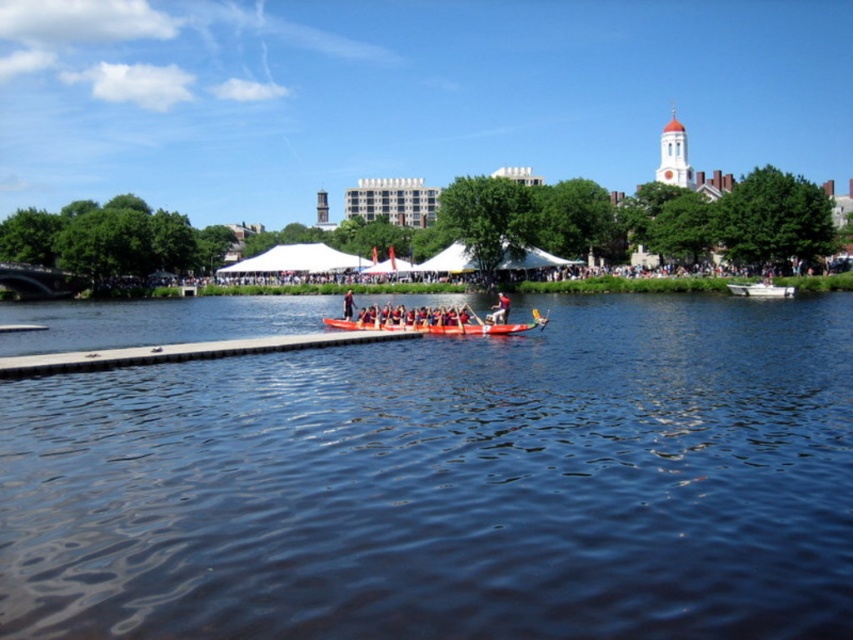
Question: Is orange glossy canoe at center to the left of wooden paddle at center from the viewer's perspective?

Choices:
 (A) no
 (B) yes

Answer: (B)

Question: Which object is closer to the camera taking this photo?

Choices:
 (A) dark blue water at center
 (B) smooth red boat at center

Answer: (A)

Question: Is orange glossy canoe at center behind wooden paddle at center?

Choices:
 (A) yes
 (B) no

Answer: (B)

Question: Does orange glossy canoe at center appear over wooden paddle at center?

Choices:
 (A) no
 (B) yes

Answer: (A)

Question: Among these points, which one is farthest from the camera?

Choices:
 (A) (463, 305)
 (B) (368, 321)

Answer: (A)

Question: Which point is closer to the camera?

Choices:
 (A) (538, 316)
 (B) (56, 595)
 (C) (465, 305)
 (D) (506, 308)

Answer: (B)